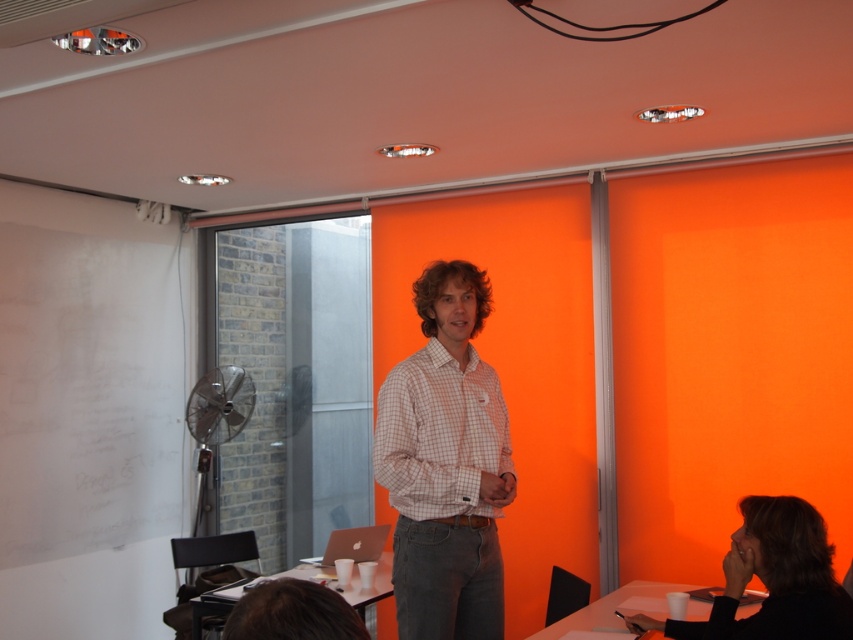
Is checkered fabric shirt at center thinner than black fabric hair at lower right?

Correct, checkered fabric shirt at center's width is less than black fabric hair at lower right's.

Is point (450, 595) farther from camera compared to point (740, 588)?

That is True.

Who is more forward, (468, 618) or (814, 616)?

Point (814, 616) is in front.

Locate an element on the screen. The height and width of the screenshot is (640, 853). checkered fabric shirt at center is located at coordinates (445, 465).